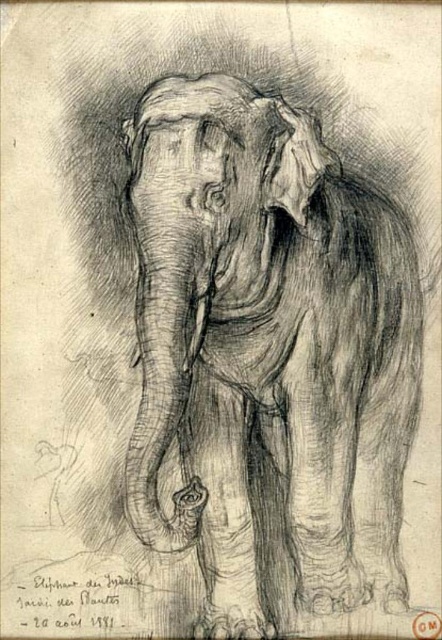
Question: Does charcoal sketch elephant at center appear on the right side of charcoal textured elephant head at center?

Choices:
 (A) no
 (B) yes

Answer: (B)

Question: Which of the following is the closest to the observer?

Choices:
 (A) (290, 188)
 (B) (323, 225)

Answer: (A)

Question: Where is charcoal sketch elephant at center located in relation to charcoal textured elephant head at center in the image?

Choices:
 (A) below
 (B) above

Answer: (A)

Question: Is charcoal sketch elephant at center to the right of charcoal textured elephant head at center from the viewer's perspective?

Choices:
 (A) yes
 (B) no

Answer: (A)

Question: Among these points, which one is farthest from the camera?

Choices:
 (A) (300, 392)
 (B) (171, 99)

Answer: (A)

Question: Among these points, which one is farthest from the camera?

Choices:
 (A) (221, 195)
 (B) (312, 298)

Answer: (B)